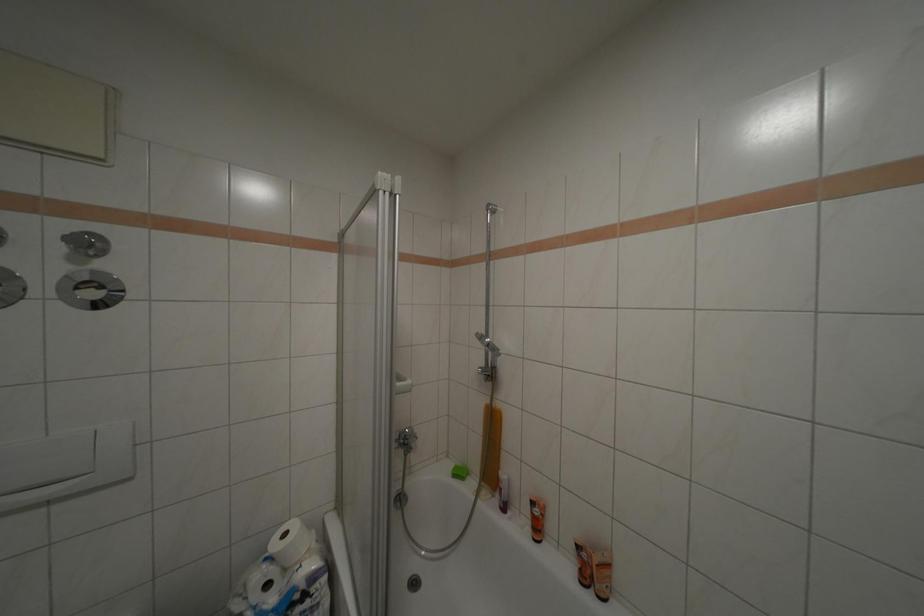
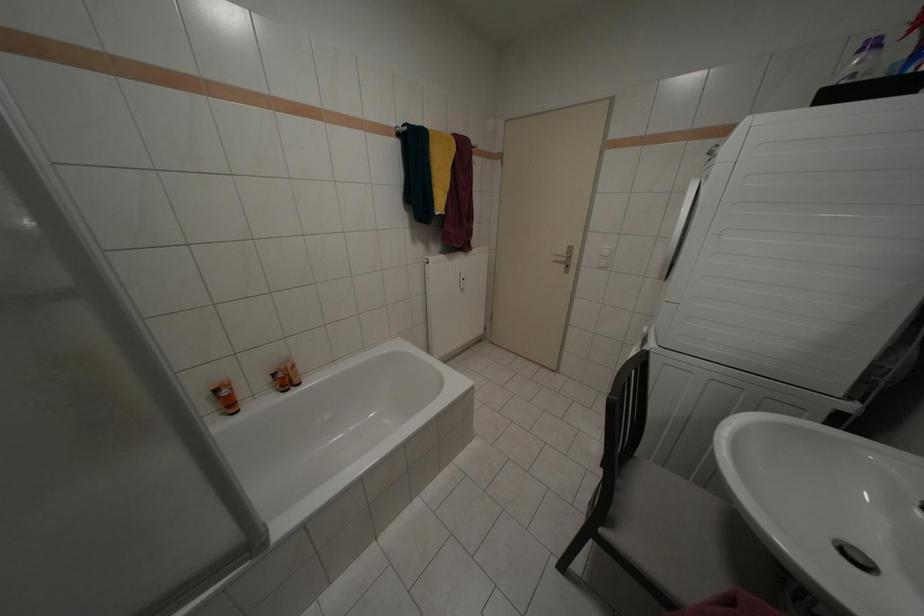
First-person continuous shooting, in which direction is the camera rotating?

The camera rotated toward right-down.